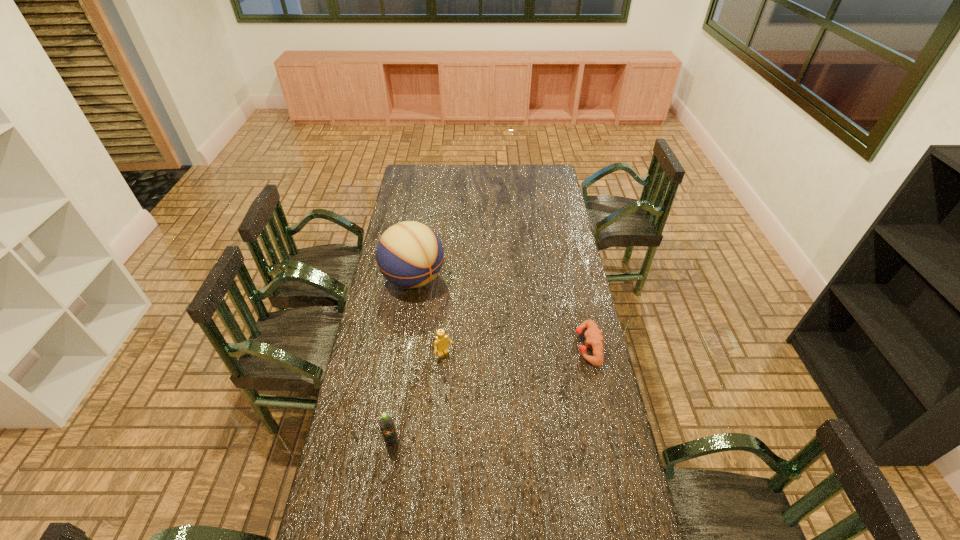
I want to click on vacant point located 0.070m with the gloves of the puncher facing forward, so click(x=558, y=346).

The width and height of the screenshot is (960, 540). Identify the location of free space located 0.140m on the face of the Lego. (470, 388).

Locate an element on the screen. This screenshot has height=540, width=960. free spot located on the face of the Lego is located at coordinates (468, 386).

I want to click on vacant space situated on the face of the Lego, so click(481, 402).

You are a GUI agent. You are given a task and a screenshot of the screen. Output one action in this format:
    pyautogui.click(x=<x>, y=<y>)
    Task: Click on the vacant space located on the patterned surface of the tallest object
    
    Given the screenshot: What is the action you would take?
    pyautogui.click(x=477, y=334)

Find the location of a particular element. free space located 0.240m on the patterned surface of the tallest object is located at coordinates (470, 328).

The height and width of the screenshot is (540, 960). Identify the location of free spot located 0.090m on the patterned surface of the tallest object. (446, 308).

You are a GUI agent. You are given a task and a screenshot of the screen. Output one action in this format:
    pyautogui.click(x=<x>, y=<y>)
    Task: Click on the soda present at the left edge
    
    Given the screenshot: What is the action you would take?
    pyautogui.click(x=386, y=423)

Where is `basketball that is at the left edge`? This screenshot has height=540, width=960. basketball that is at the left edge is located at coordinates (409, 254).

This screenshot has height=540, width=960. Identify the location of object that is positioned at the right edge. (593, 335).